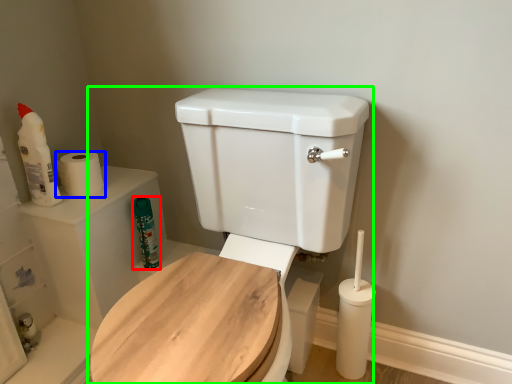
Question: Which is farther away from cleaning product (highlighted by a red box)? toilet paper (highlighted by a blue box) or toilet (highlighted by a green box)?

Choices:
 (A) toilet paper
 (B) toilet

Answer: (B)